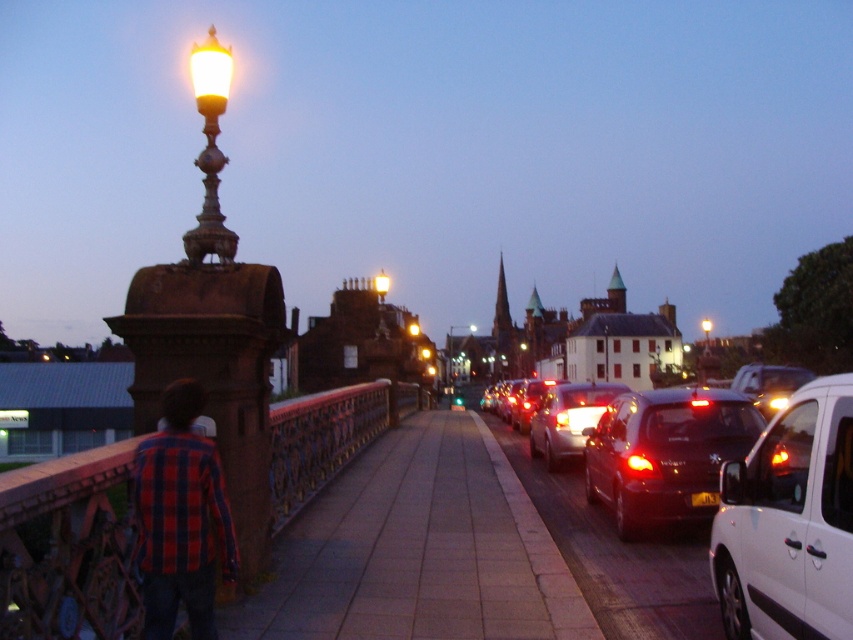
Looking at this image, you are standing on the pedestrian walkway and want to cross to the other side of the road. Which object, the metallic brown bridge at center or the metallic silver car at right, is closer to your current position?

The metallic brown bridge at center is closer to your current position because it is positioned to the left of the metallic silver car at right, meaning it is nearer to the pedestrian walkway where you are standing.

You are standing on the bridge and want to cross to the other side. There is a shiny dark red car at right and a plaid shirt at left. Which object is closer to you, the observer?

The shiny dark red car at right is closer to you because it is further to the viewer than the plaid shirt at left, meaning it appears nearer in the scene.

You are standing on the bridge and want to walk towards the point that is closer to you. Which point should you head towards, point (x=315, y=442) or point (x=746, y=387)?

You should head towards point (x=315, y=442) because it is closer to the viewer than point (x=746, y=387).